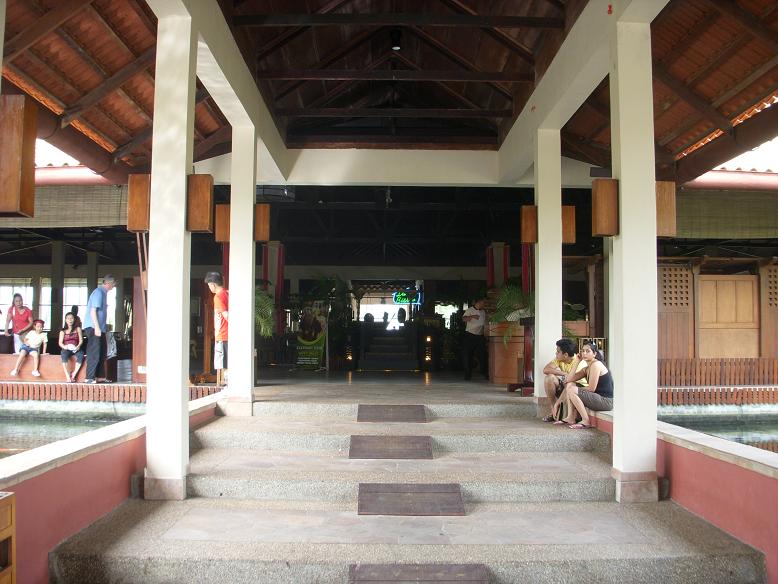
What are the coordinates of `black pillar` in the screenshot? It's located at (57, 286), (89, 276).